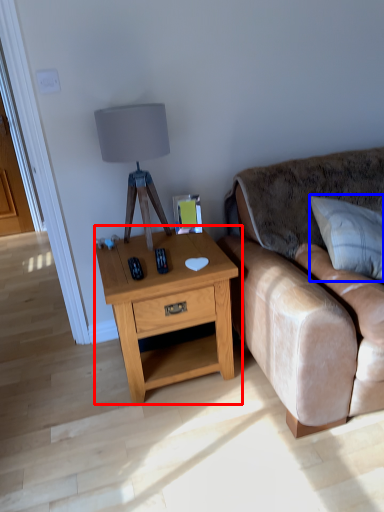
Question: Which point is further to the camera, nightstand (highlighted by a red box) or pillow (highlighted by a blue box)?

Choices:
 (A) nightstand
 (B) pillow

Answer: (A)